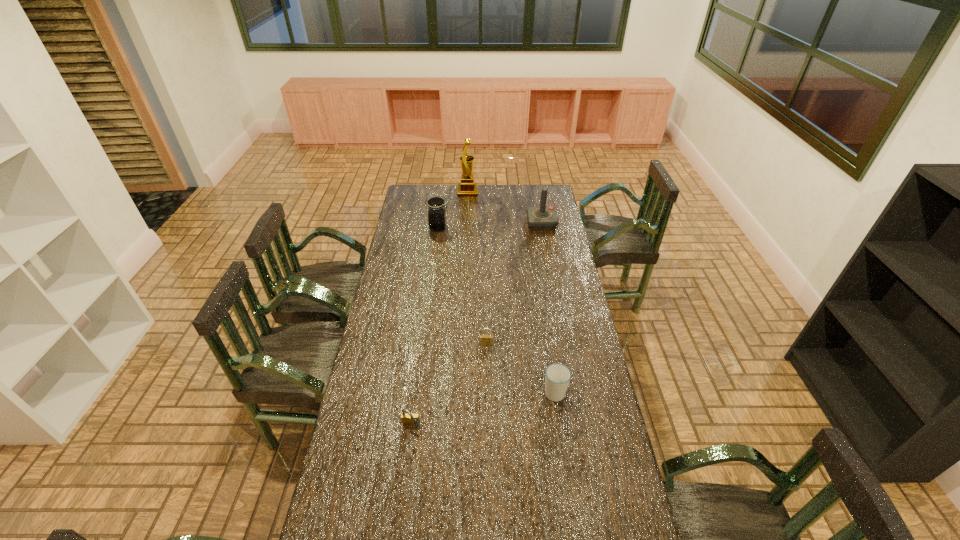
The height and width of the screenshot is (540, 960). In order to click on free space located 0.270m on the rectangular base of the joystick in this screenshot , I will do tap(479, 223).

This screenshot has width=960, height=540. I want to click on vacant space situated 0.120m on the rectangular base of the joystick, so click(506, 223).

The width and height of the screenshot is (960, 540). I want to click on free spot located on the rectangular base of the joystick, so (x=506, y=223).

Locate an element on the screen. This screenshot has width=960, height=540. free space located on the lid of the jar is located at coordinates (513, 227).

The height and width of the screenshot is (540, 960). What are the coordinates of `vacant area situated with a handle on the side of the cup` in the screenshot? It's located at (546, 334).

This screenshot has height=540, width=960. What are the coordinates of `vacant space situated with a handle on the side of the cup` in the screenshot? It's located at (546, 340).

What are the coordinates of `vacant space situated with a handle on the side of the cup` in the screenshot? It's located at (545, 327).

Locate an element on the screen. The image size is (960, 540). free space located 0.050m on the side with the combination dials of the nearest object is located at coordinates tap(409, 445).

Where is `vacant space located 0.150m on the front-facing side of the right padlock`? Image resolution: width=960 pixels, height=540 pixels. vacant space located 0.150m on the front-facing side of the right padlock is located at coordinates (487, 376).

Where is `object at the far edge`? The height and width of the screenshot is (540, 960). object at the far edge is located at coordinates (467, 188).